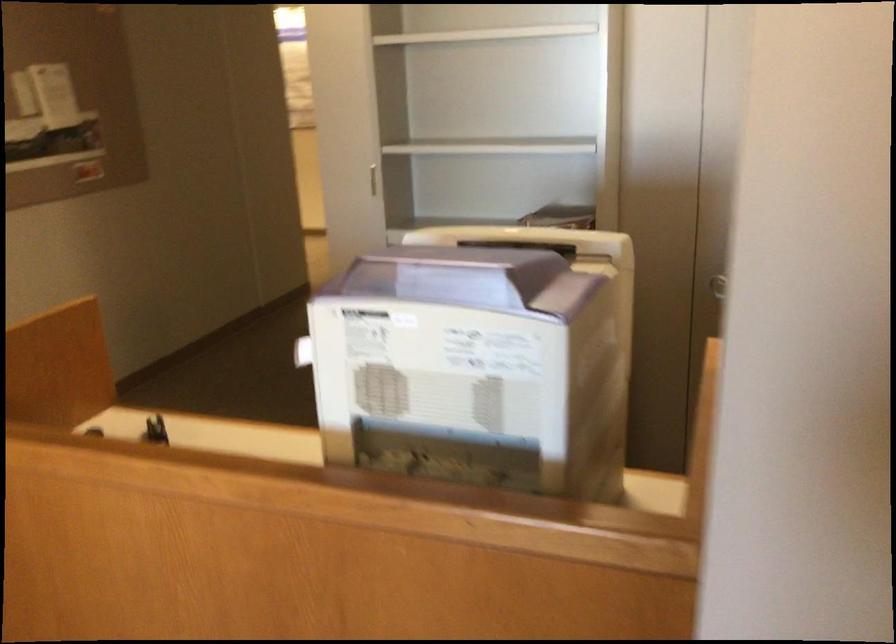
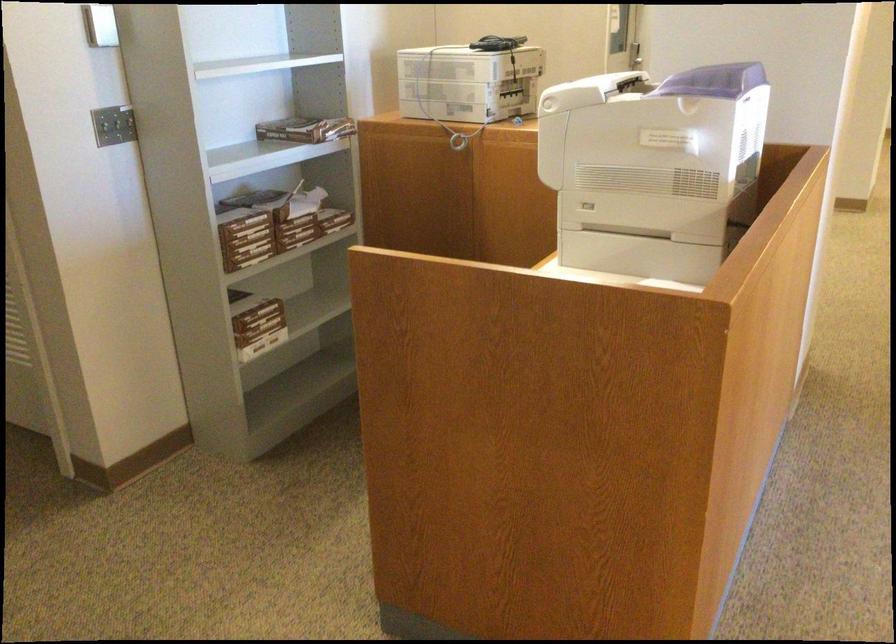
The point at (514, 214) is marked in the first image. Where is the corresponding point in the second image?

(306, 129)